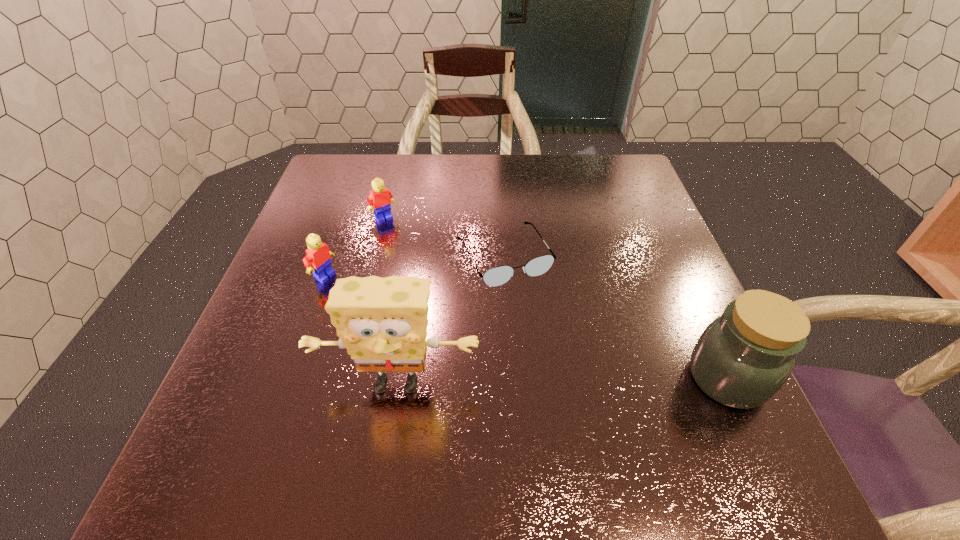
I want to click on free spot on the desktop that is between the sponge and the second tallest object and is positioned on the front-facing side of the nearer Lego, so click(533, 381).

Locate an element on the screen. vacant space on the desktop that is between the sponge and the rightmost object and is positioned on the front-facing side of the right Lego is located at coordinates (516, 381).

You are a GUI agent. You are given a task and a screenshot of the screen. Output one action in this format:
    pyautogui.click(x=<x>, y=<y>)
    Task: Click on the vacant space on the desktop that is between the tallest object and the jar and is positioned on the lenses of the spectacles
    
    Given the screenshot: What is the action you would take?
    pyautogui.click(x=576, y=380)